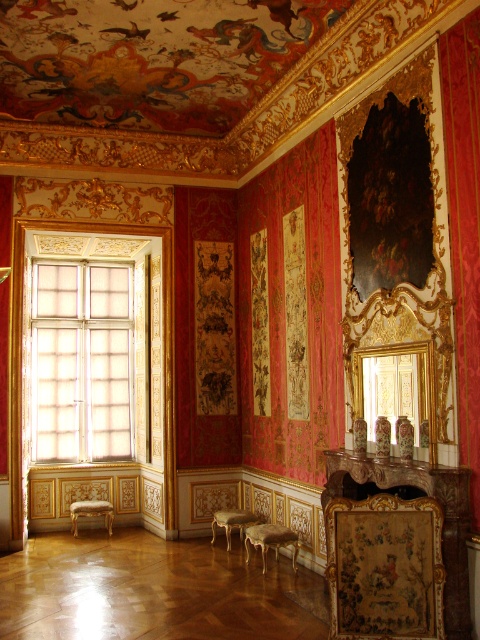
Question: Which of the following is the closest to the observer?

Choices:
 (A) (90, 429)
 (B) (78, 508)
 (C) (275, 536)

Answer: (C)

Question: Is translucent glass window at left thinner than gold upholstered stool at lower left?

Choices:
 (A) yes
 (B) no

Answer: (B)

Question: Can you confirm if gold upholstered stool at lower center is wider than gold upholstered stool at lower left?

Choices:
 (A) no
 (B) yes

Answer: (A)

Question: Among these objects, which one is farthest from the camera?

Choices:
 (A) gold upholstered stool at lower center
 (B) translucent glass window at left
 (C) gold upholstered stool at lower left

Answer: (B)

Question: Which point appears closest to the camera in this image?

Choices:
 (A) (266, 550)
 (B) (80, 508)
 (C) (99, 396)

Answer: (A)

Question: Is the position of translucent glass window at left more distant than that of gold upholstered stool at lower center?

Choices:
 (A) no
 (B) yes

Answer: (B)